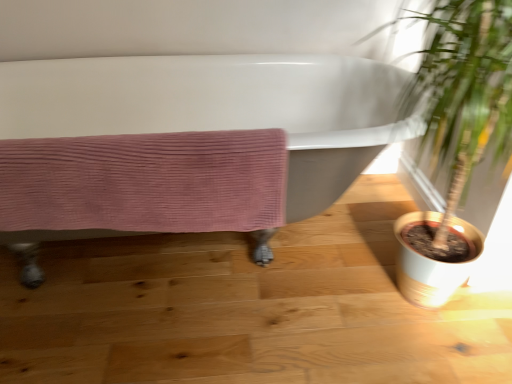
Question: From a real-world perspective, is pink corduroy towel at lower left above or below green leafy plant at right?

Choices:
 (A) below
 (B) above

Answer: (A)

Question: Choose the correct answer: Is pink corduroy towel at lower left inside green leafy plant at right or outside it?

Choices:
 (A) outside
 (B) inside

Answer: (A)

Question: Estimate the real-world distances between objects in this image. Which object is farther from the green leafy plant at right?

Choices:
 (A) pink corduroy towel at lower left
 (B) white glossy bathtub at center

Answer: (B)

Question: Considering the real-world distances, which object is closest to the white glossy bathtub at center?

Choices:
 (A) pink corduroy towel at lower left
 (B) green leafy plant at right

Answer: (B)